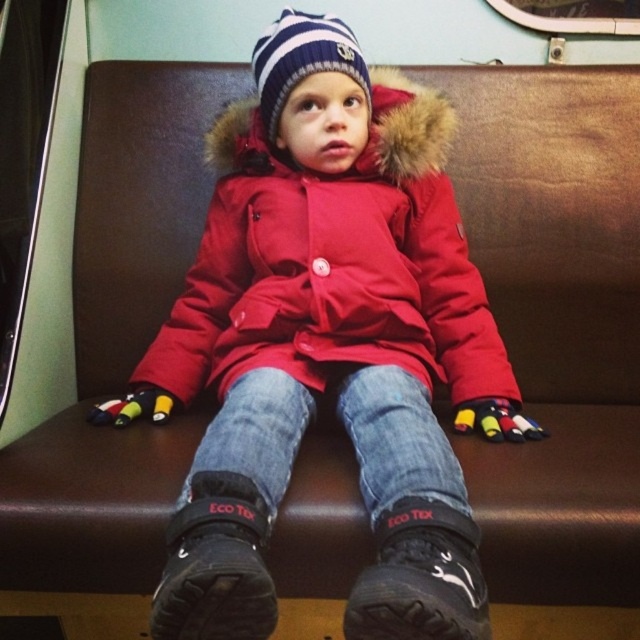
The child is sitting on a bench. You need to determine which item is shorter between the jeans at center and the striped knit hat at center. Which one is shorter?

The jeans at center is not as tall as striped knit hat at center, so the jeans at center is shorter.

The child is wearing a matte red coat at center and a red matte jacket at center. Which clothing item is positioned lower on the child?

The matte red coat at center is located below the red matte jacket at center, so the matte red coat at center is positioned lower on the child.

In the image, there is a young child sitting on a brown leather bench. The child is wearing a red puffer jacket with a fur lined hood, blue jeans, black boots labeled ECO Tex, and colorful fingerless gloves. The child also has a striped knit hat with a pom pom on top. The background has a light green wall and part of a window frame on the left. What is located at the point with coordinates (333, 262)?

The point at coordinates (333, 262) indicates the red matte jacket at center.